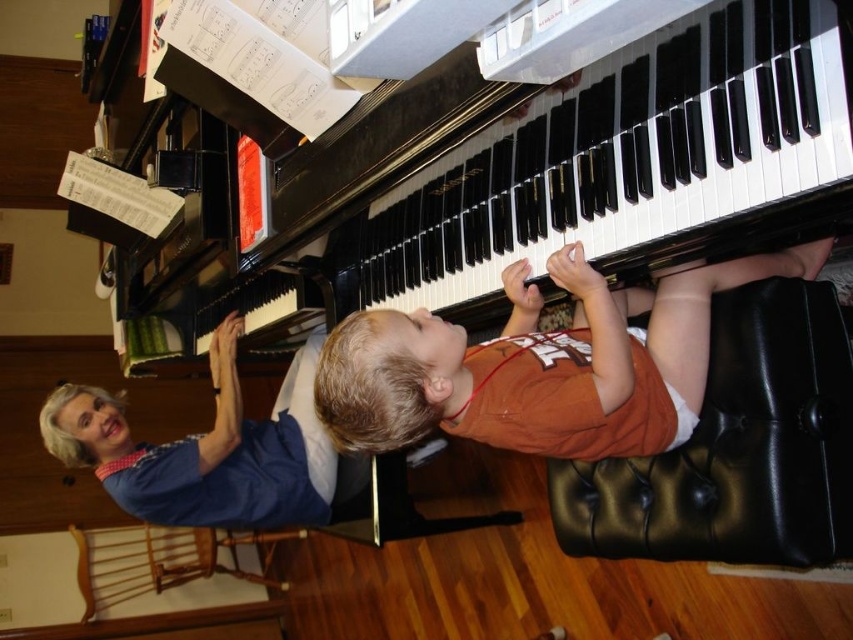
You are a photographer taking a picture of the scene. You need to place a small sticker on the point that is closer to you. Which point should you choose between point [514,289] and point [750,404]?

Point [750,404] is closer to you since it is less further than point [514,289].

You are a parent trying to place a small potted plant between the black leather ottoman at lower right and the wooden chair at lower left. Based on their positions, where should you place the plant to ensure it is between both objects?

The black leather ottoman at lower right is positioned on the right side of wooden chair at lower left, so placing the plant to the right of the wooden chair at lower left and left of the black leather ottoman at lower right will place it between both objects.